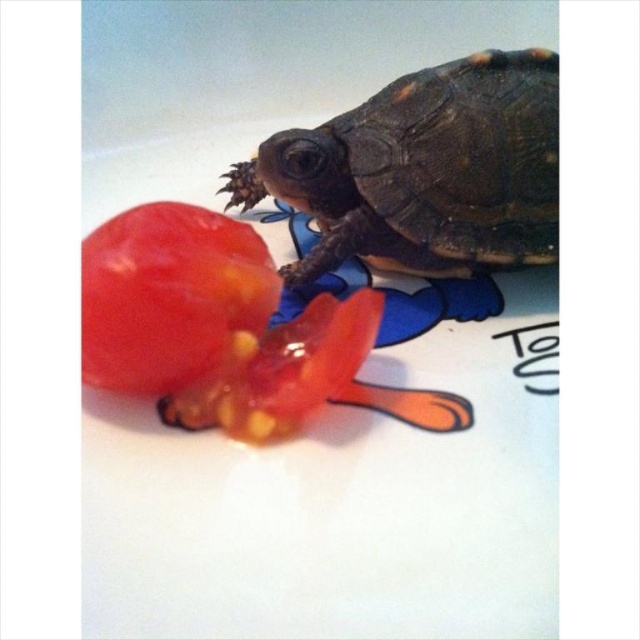
You are a photographer trying to capture a closeup of the shiny red tomato at center. However, the smooth brown tortoise at upper right is blocking your view. Can you tell me which object is closer to you to decide if you need to move the tortoise?

The smooth brown tortoise at upper right is closer to you than the shiny red tomato at center, so you need to move the tortoise to get an unobstructed view of the tomato.

Consider the image. You are a small animal trying to reach the shiny red tomato at center. The smooth brown tortoise at upper right is blocking your path. Can you go under it without climbing?

The smooth brown tortoise at upper right is much taller than the shiny red tomato at center, so you cannot go under it without climbing.

From the picture: You are a researcher studying animal behavior. You observe a smooth brown tortoise at upper right and a shiny red tomato at center in the image. Which object is wider?

The smooth brown tortoise at upper right is wider than the shiny red tomato at center according to the description.